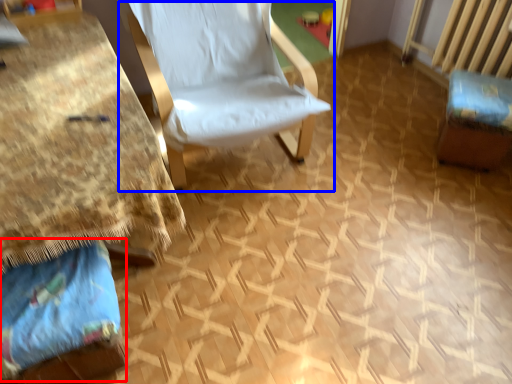
Question: Which object is further to the camera taking this photo, fabric (highlighted by a red box) or chair (highlighted by a blue box)?

Choices:
 (A) fabric
 (B) chair

Answer: (B)